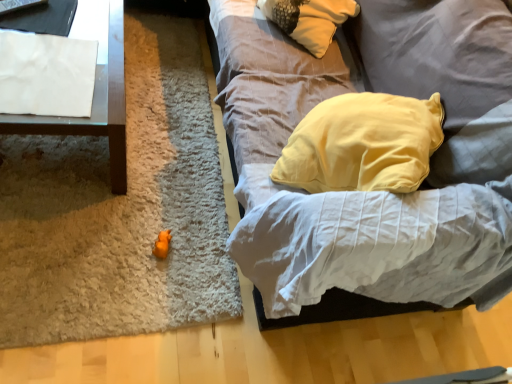
Image resolution: width=512 pixels, height=384 pixels. Find the location of `free space above white paper at left (from a real-world perspective)`. free space above white paper at left (from a real-world perspective) is located at coordinates (54, 44).